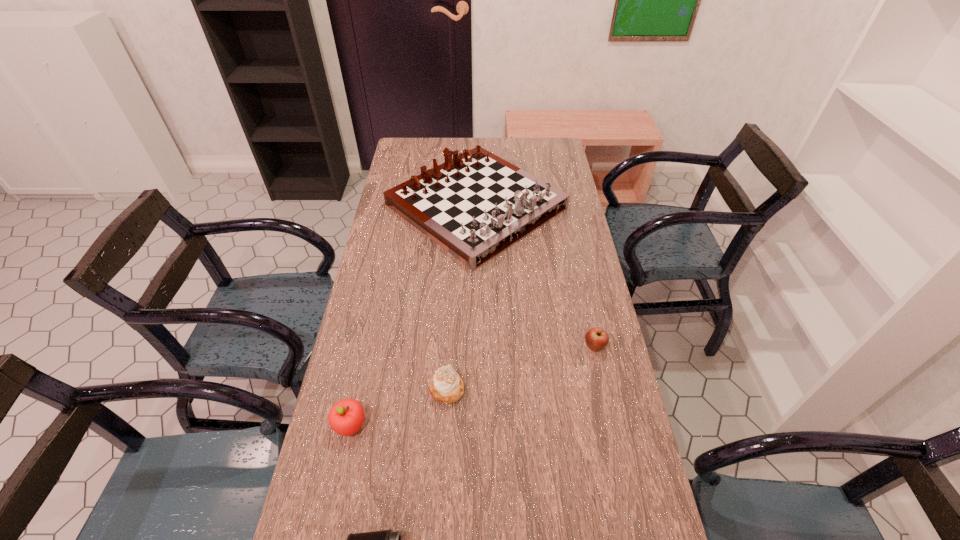
Find the location of a particular element. The width and height of the screenshot is (960, 540). free space at the right edge is located at coordinates (560, 180).

This screenshot has height=540, width=960. In order to click on vacant point at the far left corner in this screenshot , I will do `click(418, 138)`.

The width and height of the screenshot is (960, 540). In the image, there is a desktop. In order to click on vacant space at the far right corner in this screenshot , I will do `click(550, 161)`.

Identify the location of vacant region between the pastry and the left apple. (398, 407).

Locate an element on the screen. This screenshot has height=540, width=960. blank region between the fourth farthest object and the pastry is located at coordinates (398, 407).

The height and width of the screenshot is (540, 960). I want to click on object that stands as the fourth closest to the third nearest object, so click(x=476, y=205).

Where is `object identified as the closest to the tallest object`? The image size is (960, 540). object identified as the closest to the tallest object is located at coordinates (596, 338).

The width and height of the screenshot is (960, 540). Find the location of `free location that satisfies the following two spatial constraints: 1. on the back side of the pastry; 2. on the right side of the tallest object`. free location that satisfies the following two spatial constraints: 1. on the back side of the pastry; 2. on the right side of the tallest object is located at coordinates (458, 206).

Where is `vacant region that satisfies the following two spatial constraints: 1. on the back side of the taller apple; 2. on the right side of the farther apple`? vacant region that satisfies the following two spatial constraints: 1. on the back side of the taller apple; 2. on the right side of the farther apple is located at coordinates (367, 347).

What are the coordinates of `vacant region that satisfies the following two spatial constraints: 1. on the front side of the gameboard; 2. on the right side of the right apple` in the screenshot? It's located at (475, 347).